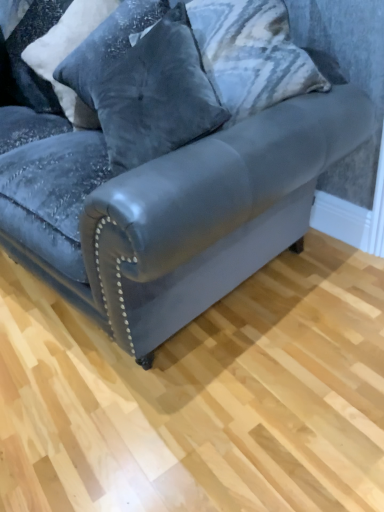
Question: Is velvet dark gray pillow at upper left, which ranks as the 2th pillow in left-to-right order, outside velvet dark blue couch at center?

Choices:
 (A) yes
 (B) no

Answer: (B)

Question: Is velvet dark gray pillow at upper left, which is the third pillow in right-to-left order, placed right next to velvet dark blue couch at center?

Choices:
 (A) no
 (B) yes

Answer: (A)

Question: Does velvet dark gray pillow at upper left, which ranks as the 2th pillow in left-to-right order, have a smaller size compared to velvet dark blue couch at center?

Choices:
 (A) no
 (B) yes

Answer: (B)

Question: Can you confirm if velvet dark gray pillow at upper left, which ranks as the 2th pillow in left-to-right order, is wider than velvet dark blue couch at center?

Choices:
 (A) no
 (B) yes

Answer: (A)

Question: From a real-world perspective, is velvet dark gray pillow at upper left, which ranks as the 2th pillow in left-to-right order, on top of velvet dark blue couch at center?

Choices:
 (A) no
 (B) yes

Answer: (B)

Question: Is velvet dark gray pillow at upper left, which is the third pillow in right-to-left order, surrounding velvet dark blue couch at center?

Choices:
 (A) no
 (B) yes

Answer: (A)

Question: Does velvet gray pillow at upper center, placed as the 1th pillow when sorted from right to left, touch velvet dark blue pillow at upper left, placed as the 1th pillow when sorted from left to right?

Choices:
 (A) yes
 (B) no

Answer: (B)

Question: Is velvet gray pillow at upper center, placed as the 1th pillow when sorted from right to left, to the left of velvet dark blue pillow at upper left, placed as the 1th pillow when sorted from left to right, from the viewer's perspective?

Choices:
 (A) yes
 (B) no

Answer: (B)

Question: From the image's perspective, would you say velvet gray pillow at upper center, placed as the 1th pillow when sorted from right to left, is positioned over velvet dark blue pillow at upper left, placed as the 1th pillow when sorted from left to right?

Choices:
 (A) yes
 (B) no

Answer: (B)

Question: Considering the relative positions of velvet gray pillow at upper center, which appears as the 4th pillow when viewed from the left, and velvet dark blue pillow at upper left, the 4th pillow when ordered from right to left, in the image provided, is velvet gray pillow at upper center, which appears as the 4th pillow when viewed from the left, behind velvet dark blue pillow at upper left, the 4th pillow when ordered from right to left,?

Choices:
 (A) no
 (B) yes

Answer: (A)

Question: Can we say velvet gray pillow at upper center, which appears as the 4th pillow when viewed from the left, lies outside velvet dark blue pillow at upper left, placed as the 1th pillow when sorted from left to right?

Choices:
 (A) no
 (B) yes

Answer: (B)

Question: Considering the relative sizes of velvet gray pillow at upper center, which appears as the 4th pillow when viewed from the left, and velvet dark blue pillow at upper left, placed as the 1th pillow when sorted from left to right, in the image provided, is velvet gray pillow at upper center, which appears as the 4th pillow when viewed from the left, taller than velvet dark blue pillow at upper left, placed as the 1th pillow when sorted from left to right,?

Choices:
 (A) no
 (B) yes

Answer: (B)

Question: Can you confirm if velvet pillow at upper left, which appears as the 2th pillow when viewed from the right, is positioned to the right of velvet gray pillow at upper center, placed as the 1th pillow when sorted from right to left?

Choices:
 (A) yes
 (B) no

Answer: (B)